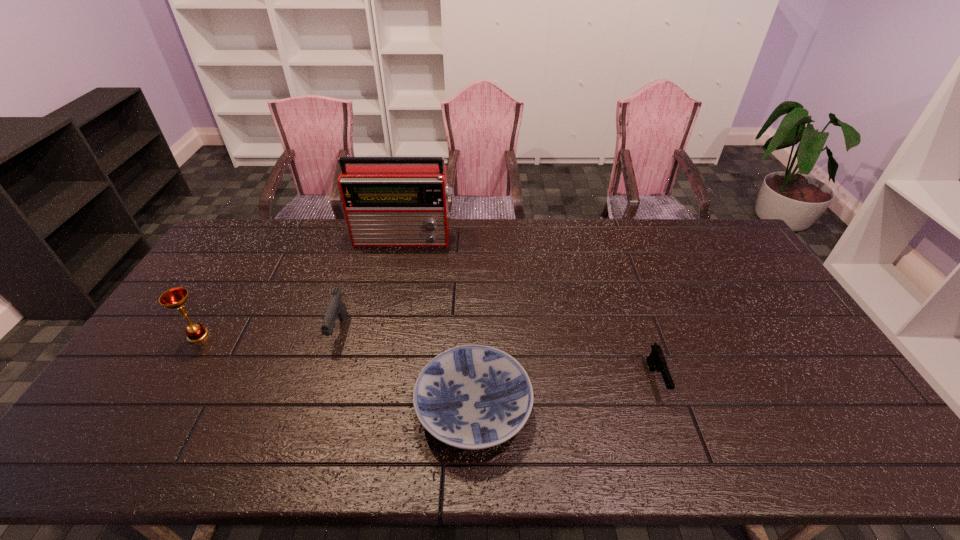
The width and height of the screenshot is (960, 540). What are the coordinates of `vacant space located 0.310m on the right of the chalice` in the screenshot? It's located at (316, 335).

I want to click on free location located 0.100m at the barrel of the left pistol, so click(323, 381).

Find the location of a particular element. Image resolution: width=960 pixels, height=540 pixels. free region located on the front-facing side of the rightmost object is located at coordinates (683, 457).

I want to click on free space located 0.220m on the right of the plate, so click(618, 408).

Locate an element on the screen. This screenshot has width=960, height=540. object located in the far edge section of the desktop is located at coordinates (x=388, y=201).

The height and width of the screenshot is (540, 960). In order to click on object at the near edge in this screenshot , I will do `click(472, 397)`.

I want to click on object that is at the left edge, so click(x=175, y=298).

Identify the location of vacant area at the far edge. (518, 218).

Find the location of a particular element. The width and height of the screenshot is (960, 540). vacant space at the near edge of the desktop is located at coordinates (445, 460).

At what (x,y) coordinates should I click in order to perform the action: click on free space at the left edge of the desktop. Please return your answer as a coordinate pair (x, y). The width and height of the screenshot is (960, 540). Looking at the image, I should click on (142, 372).